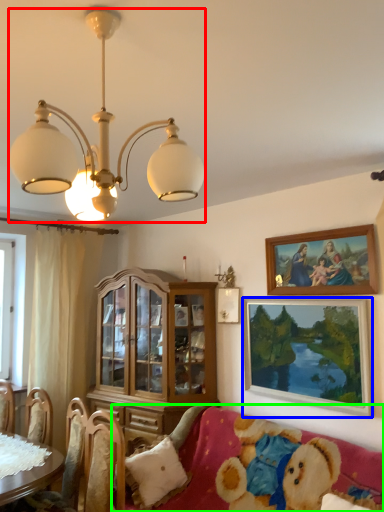
Question: Which object is positioned closest to lamp (highlighted by a red box)? Select from picture frame (highlighted by a blue box) and studio couch (highlighted by a green box).

Choices:
 (A) picture frame
 (B) studio couch

Answer: (A)